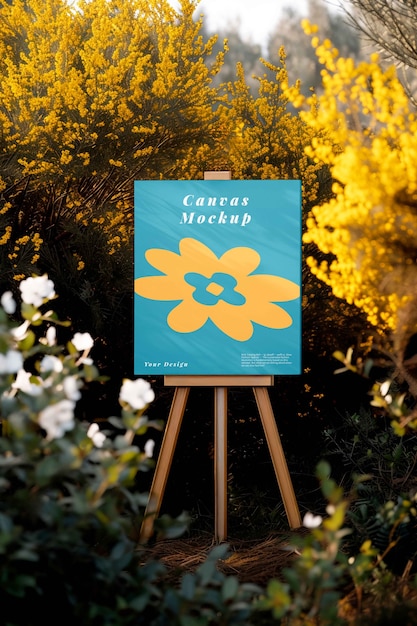
At what (x,y) coordinates should I click in order to perform the action: click on tray. Please return your answer as a coordinate pair (x, y). The width and height of the screenshot is (417, 626). Looking at the image, I should click on (214, 380).